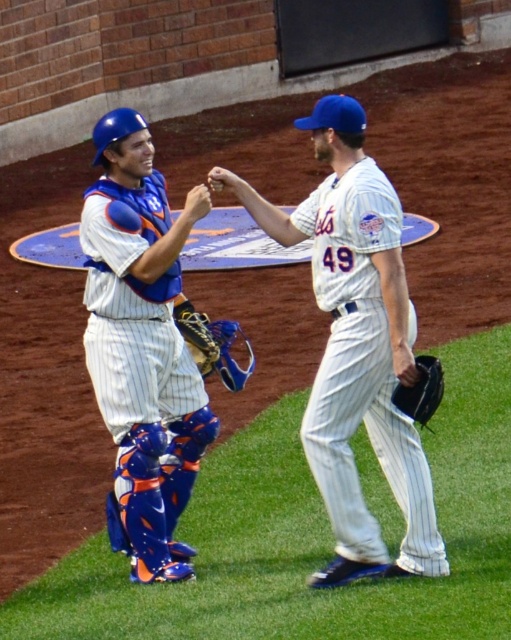
You are a baseball coach observing the field. You notice two gloves on the ground. The black leather baseball glove at right and the leather textured glove at center. Which glove is positioned further to the east?

The black leather baseball glove at right is positioned further to the east because it is to the right of the leather textured glove at center.

You are a photographer trying to capture a closeup of the white pinstriped uniform at center and the leather textured glove at center. Since you want both objects to appear the same size in the photo, which object should you move closer to the camera?

The white pinstriped uniform at center is larger in size than the leather textured glove at center, so you should move the white pinstriped uniform at center closer to the camera to make it appear smaller and match the size of the leather textured glove at center in the photo.